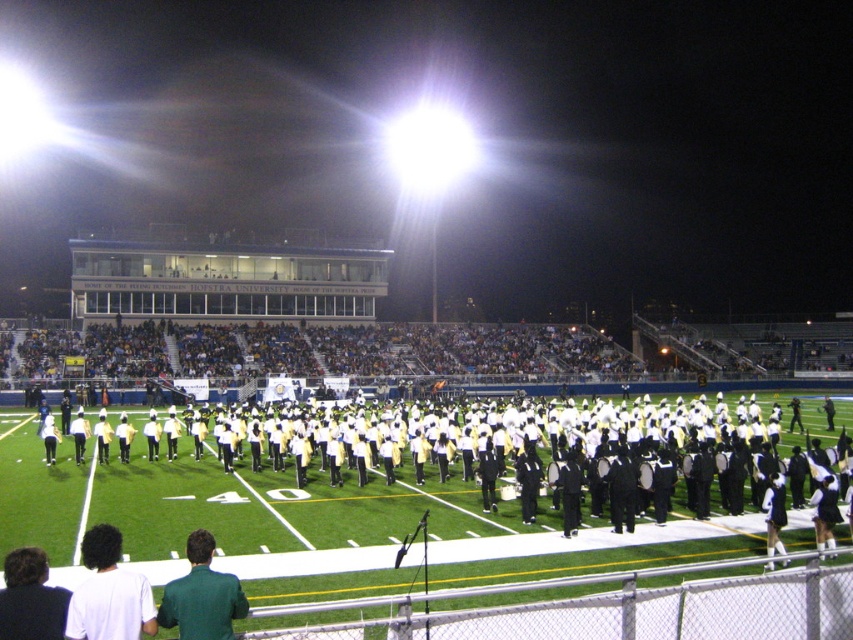
From the picture: Who is shorter, white matte shirt at lower left or green matte shirt at lower center?

With less height is green matte shirt at lower center.

Between point (126, 605) and point (169, 621), which one is positioned in front?

Point (126, 605)

Does point (137, 605) come in front of point (225, 628)?

Yes, point (137, 605) is closer to viewer.

Where is `white matte shirt at lower left`? The image size is (853, 640). white matte shirt at lower left is located at coordinates (109, 593).